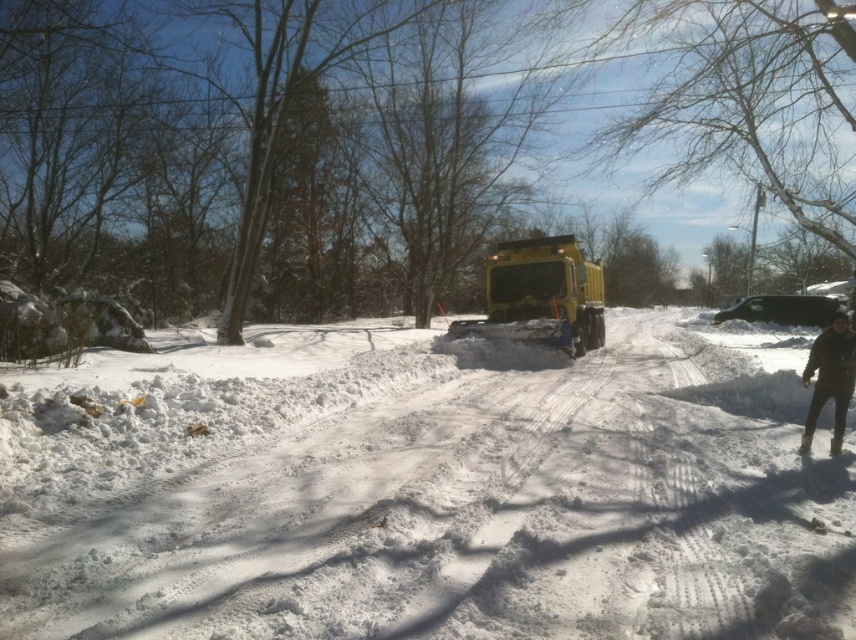
You are standing at the point marked by coordinates [438,499] in the snowy scene. What is the immediate surface beneath your feet like?

The immediate surface beneath your feet at point [438,499] is white fluffy snow.

You are a delivery driver who needs to park your van on the road where the white fluffy snow at center and the yellow rubber snowplow at center are located. Considering the space between them, will your van fit between them?

The white fluffy snow at center is wider than the yellow rubber snowplow at center. Since the snow is wider, the space between them may be sufficient for the van to fit, but this depends on the exact dimensions of the van and the available space. However, based on the width comparison alone, the snow is wider, so there might be enough space.